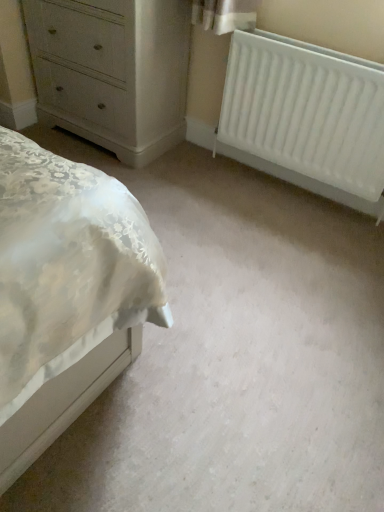
This screenshot has width=384, height=512. Identify the location of vacant area situated below white matte radiator at right (from a real-world perspective). (303, 193).